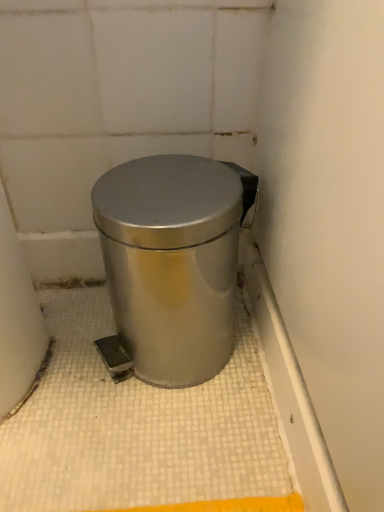
Measure the distance between satin silver trash can at center and camera.

The distance of satin silver trash can at center from camera is 16.17 inches.

Describe the element at coordinates (171, 264) in the screenshot. The width and height of the screenshot is (384, 512). I see `satin silver trash can at center` at that location.

Image resolution: width=384 pixels, height=512 pixels. I want to click on satin silver trash can at center, so click(171, 264).

Where is `satin silver trash can at center`? Image resolution: width=384 pixels, height=512 pixels. satin silver trash can at center is located at coordinates (171, 264).